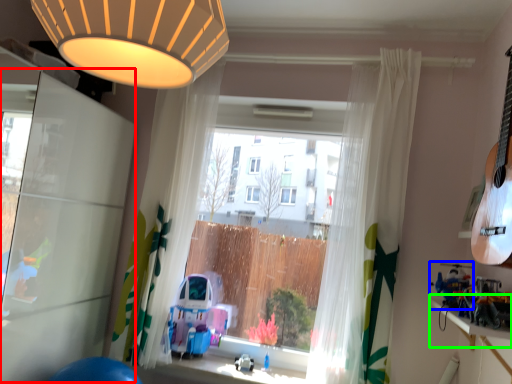
Question: Considering the real-world distances, which object is closest to screen door (highlighted by a red box)? toy (highlighted by a blue box) or window sill (highlighted by a green box).

Choices:
 (A) toy
 (B) window sill

Answer: (A)